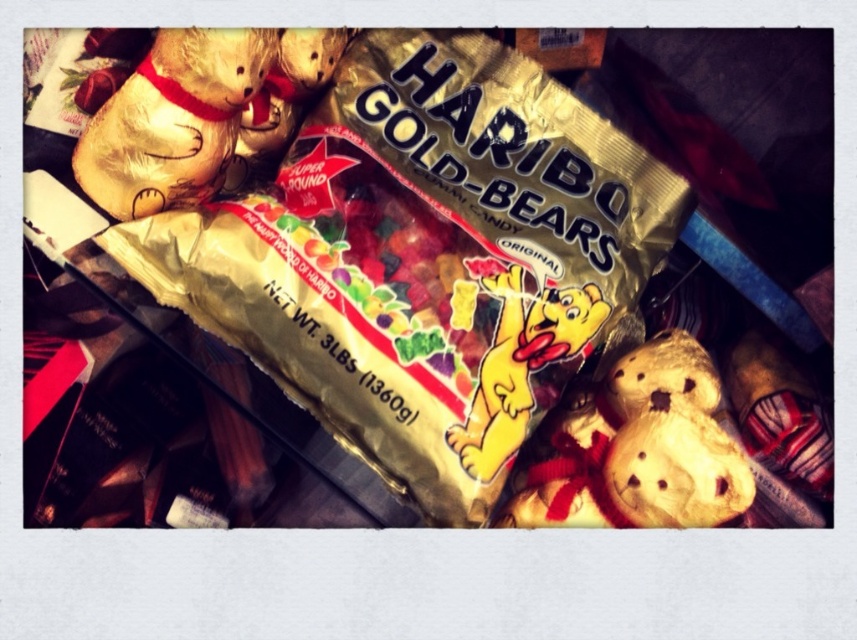
Can you confirm if matte gold plush bear at lower right is positioned to the right of gold foil bear at upper left?

Indeed, matte gold plush bear at lower right is positioned on the right side of gold foil bear at upper left.

Is matte gold plush bear at lower right bigger than gold foil bear at upper left?

Yes, matte gold plush bear at lower right is bigger than gold foil bear at upper left.

Describe the element at coordinates (637, 449) in the screenshot. I see `matte gold plush bear at lower right` at that location.

What are the coordinates of `matte gold plush bear at lower right` in the screenshot? It's located at (637, 449).

Find the location of a particular element. matte gold plush bear at lower right is located at coordinates (637, 449).

Does point (679, 358) come in front of point (577, 333)?

Yes, it is in front of point (577, 333).

Locate an element on the screen. This screenshot has width=857, height=640. matte gold plush bear at lower right is located at coordinates (637, 449).

I want to click on matte gold plush bear at lower right, so click(637, 449).

Is gold foil bear at upper left positioned in front of yellow paper bear at center?

Yes, gold foil bear at upper left is closer to the viewer.

Which is behind, point (114, 100) or point (596, 307)?

Positioned behind is point (596, 307).

Is point (141, 196) behind point (514, 275)?

That is False.

Identify the location of gold foil bear at upper left. (172, 120).